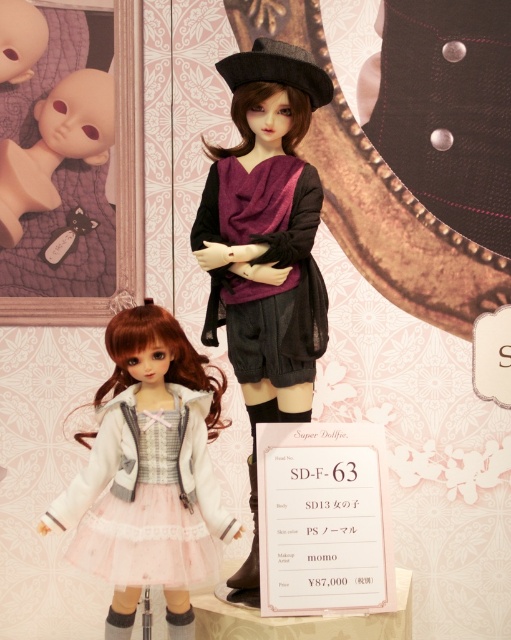
Please describe the exact location of the purple sheer scarf at center in the image using coordinates.

The purple sheer scarf at center is located at coordinates point (266, 262).

What is the color of the doll located at point (265, 248)?

The doll at point (265, 248) is matte black.

You are a photographer setting up for a product shoot. You need to ensure that the purple sheer scarf at center and the matte black doll at upper left are both visible in the frame. Based on their positions, which object is closer to the camera?

The purple sheer scarf at center is positioned under the matte black doll at upper left, which means the scarf is closer to the camera than the doll.